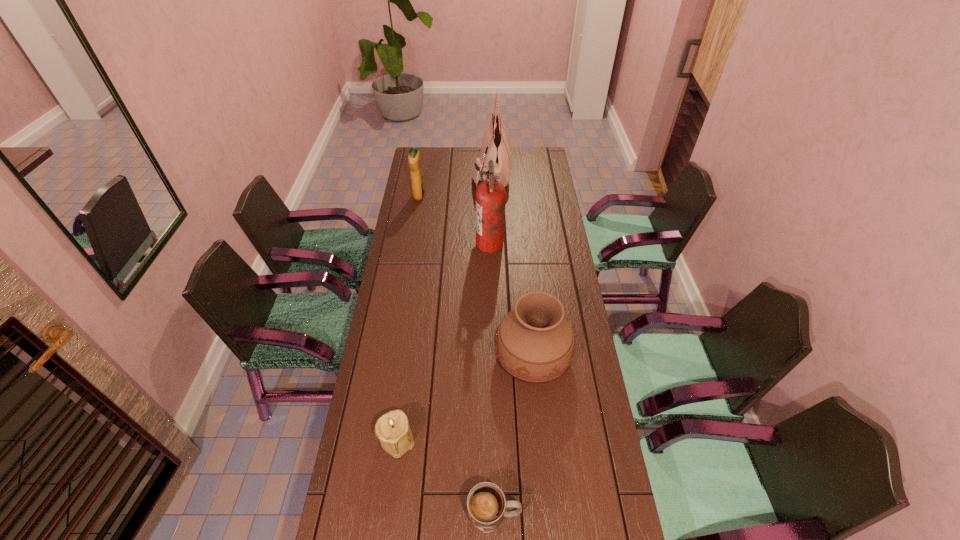
The image size is (960, 540). I want to click on candle_holder located at the left edge, so click(x=392, y=429).

Image resolution: width=960 pixels, height=540 pixels. Find the location of `object located at the right edge`. object located at the right edge is located at coordinates (534, 342).

The image size is (960, 540). Find the location of `vacant space at the far edge of the desktop`. vacant space at the far edge of the desktop is located at coordinates (454, 164).

You are a GUI agent. You are given a task and a screenshot of the screen. Output one action in this format:
    pyautogui.click(x=<x>, y=<y>)
    Task: Click on the vacant space at the left edge
    Image resolution: width=960 pixels, height=540 pixels.
    Given the screenshot: What is the action you would take?
    pyautogui.click(x=412, y=196)

In the image, there is a desktop. Where is `vacant space at the right edge`? vacant space at the right edge is located at coordinates (540, 226).

Find the location of a particular element. This screenshot has height=540, width=960. vacant space at the far right corner is located at coordinates (540, 153).

Locate an element on the screen. vacant space in between the second nearest object and the detergent is located at coordinates (408, 318).

Where is `free space between the detergent and the second shortest object`? The height and width of the screenshot is (540, 960). free space between the detergent and the second shortest object is located at coordinates (408, 318).

Find the location of a particular element. Image resolution: width=960 pixels, height=540 pixels. free space between the fifth farthest object and the detergent is located at coordinates (408, 318).

Locate an element on the screen. vacant point located between the handbag and the candle_holder is located at coordinates (444, 306).